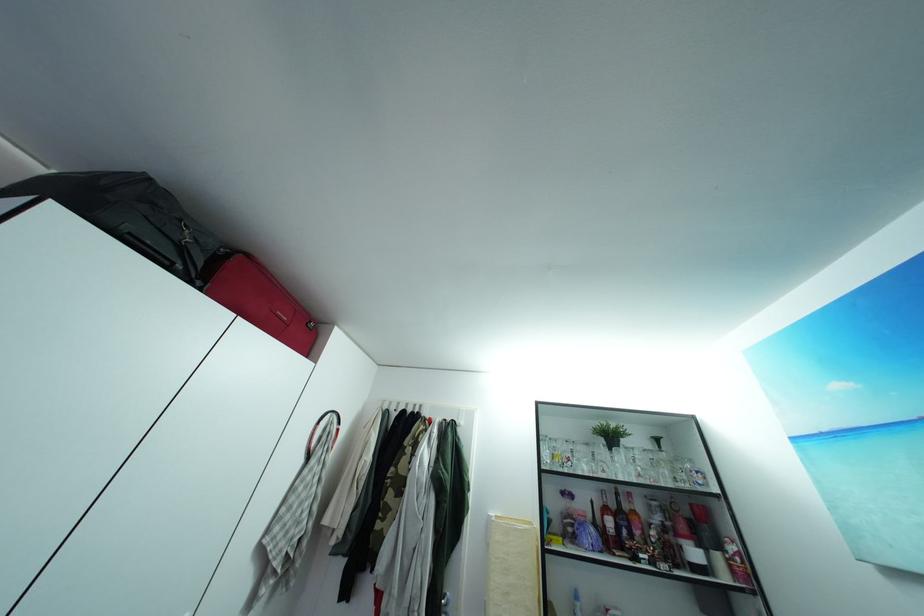
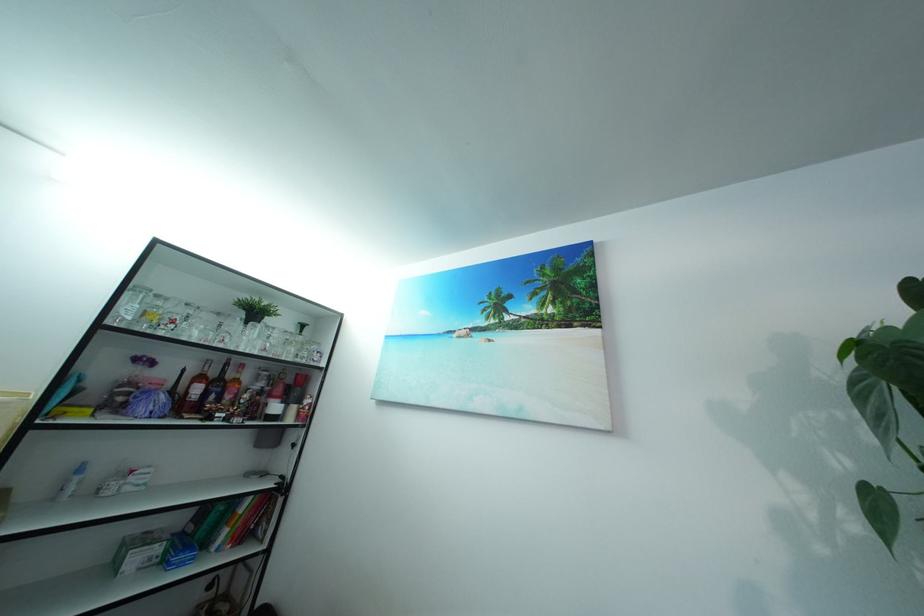
In the second image, find the point that corresponds to point 672,536 in the first image.

(269, 400)